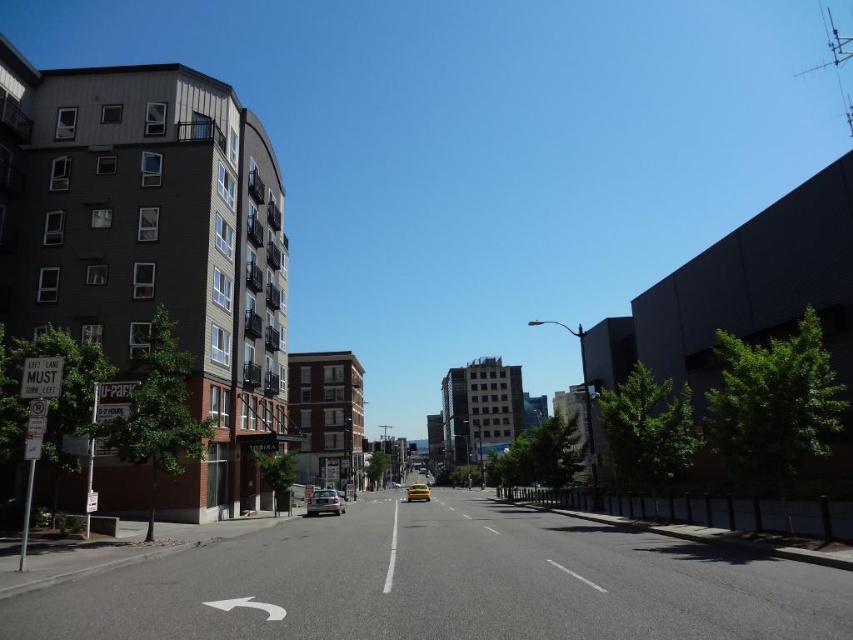
Question: Which point is farther to the camera?

Choices:
 (A) click(x=413, y=499)
 (B) click(x=320, y=499)

Answer: (A)

Question: Does silver metallic sedan at center have a larger size compared to yellow matte taxi at center?

Choices:
 (A) yes
 (B) no

Answer: (B)

Question: Which of the following is the closest to the observer?

Choices:
 (A) (424, 493)
 (B) (312, 502)

Answer: (B)

Question: Where is silver metallic sedan at center located in relation to yellow matte taxi at center in the image?

Choices:
 (A) left
 (B) right

Answer: (A)

Question: Can you confirm if silver metallic sedan at center is smaller than yellow matte taxi at center?

Choices:
 (A) yes
 (B) no

Answer: (A)